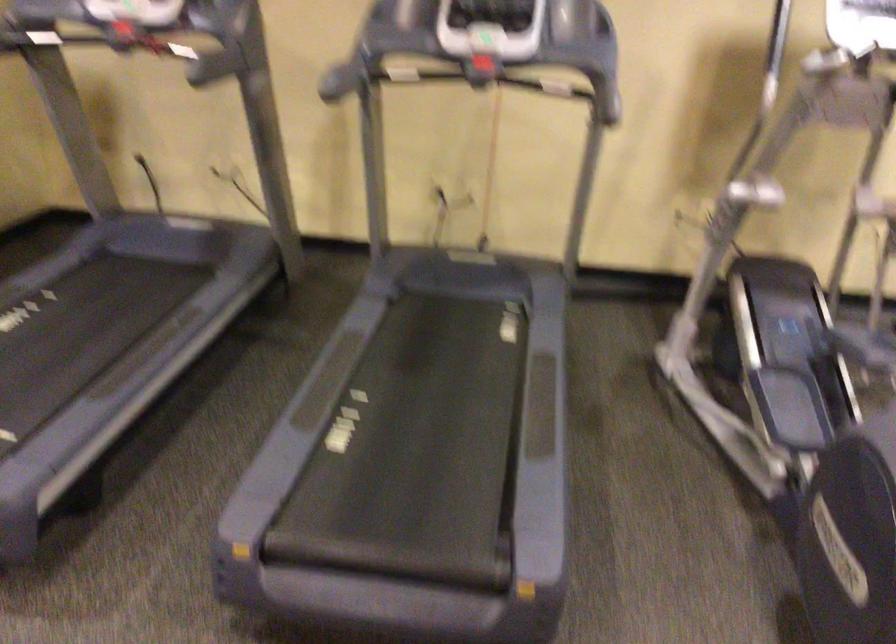
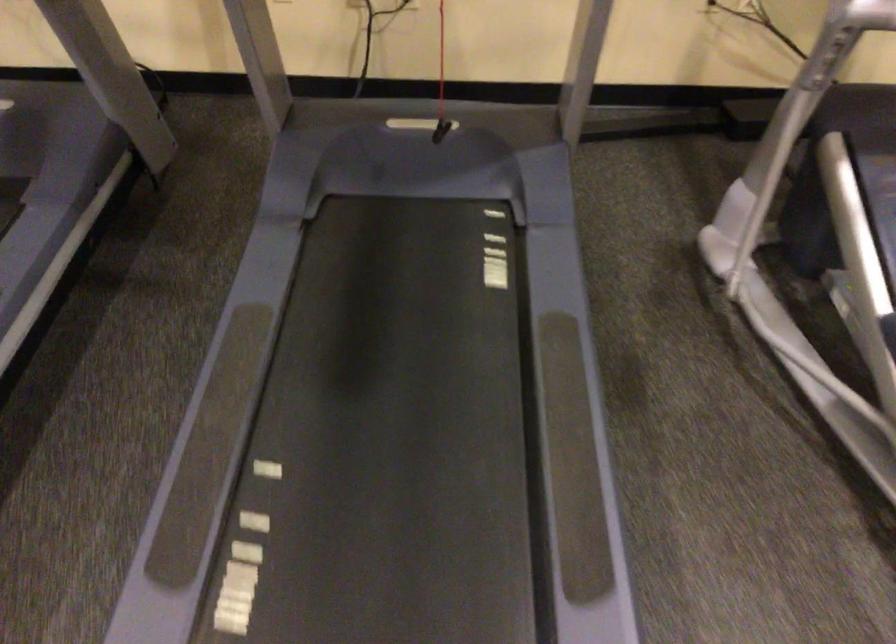
In the second image, find the point that corresponds to [769,305] in the first image.

(876, 190)